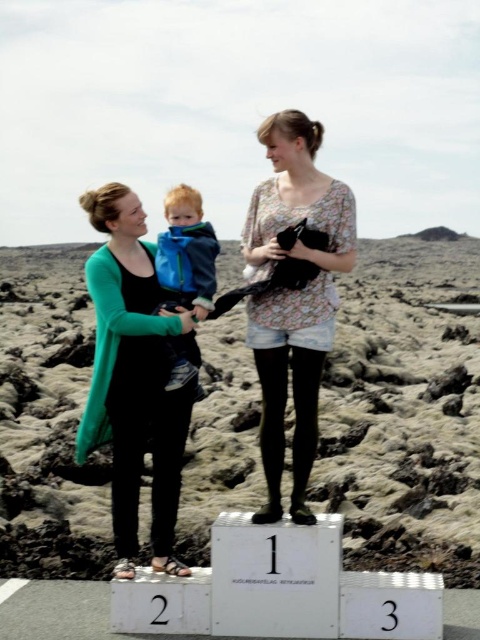
Question: Does floral-patterned shirt at center come in front of blue fleece jacket at center?

Choices:
 (A) no
 (B) yes

Answer: (B)

Question: Can you confirm if floral-patterned shirt at center is positioned below blue fleece jacket at center?

Choices:
 (A) yes
 (B) no

Answer: (A)

Question: Is floral-patterned shirt at center closer to camera compared to blue fleece jacket at center?

Choices:
 (A) no
 (B) yes

Answer: (B)

Question: Which point is farther to the camera?

Choices:
 (A) (255, 234)
 (B) (204, 227)
 (C) (156, 556)

Answer: (B)

Question: Which point appears closest to the camera in this image?

Choices:
 (A) (193, 278)
 (B) (145, 384)
 (C) (264, 241)

Answer: (B)

Question: Which point is closer to the camera taking this photo?

Choices:
 (A) (94, 444)
 (B) (303, 168)
 (C) (178, 252)

Answer: (B)